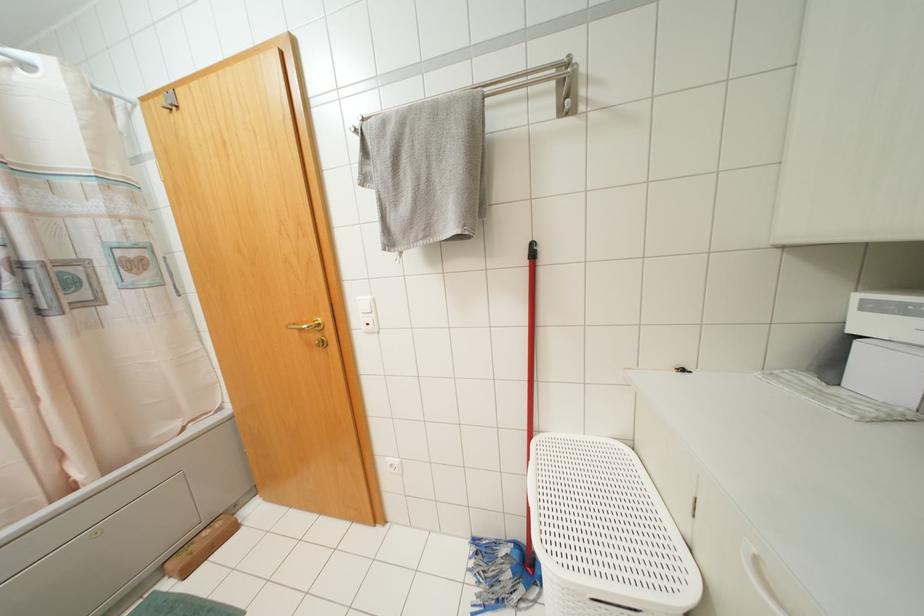
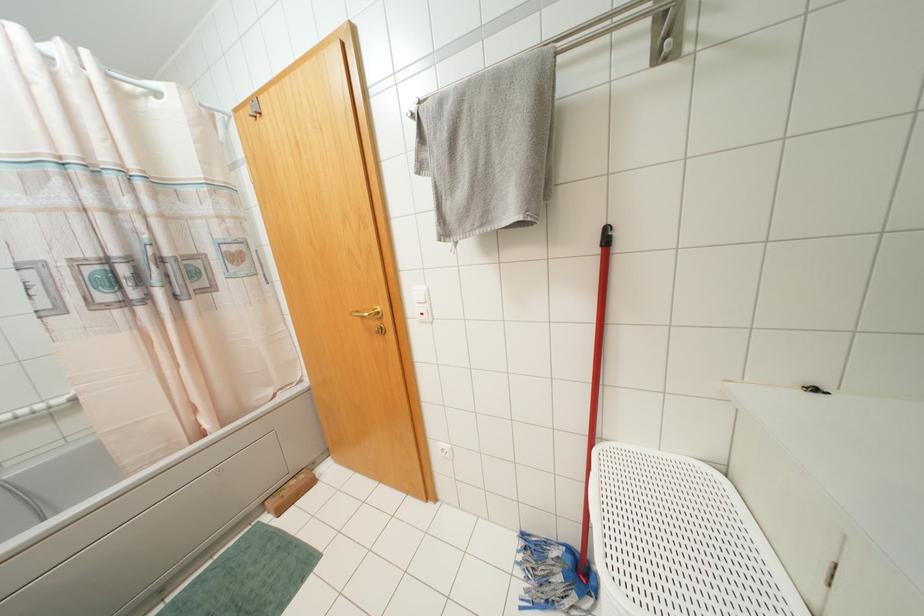
In the second image, find the point that corresponds to pixel 319 323 in the first image.

(378, 312)